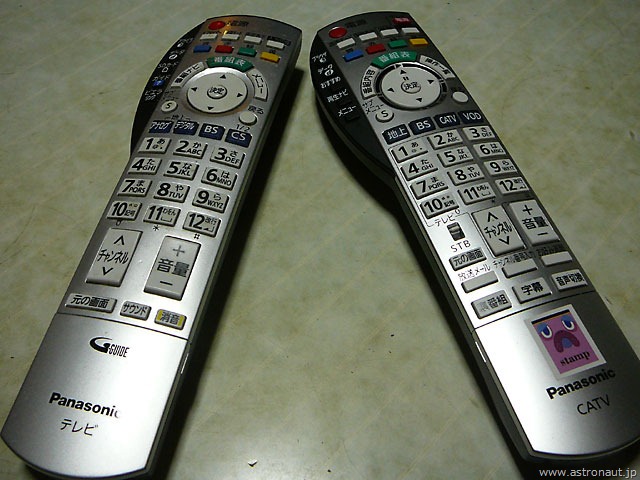
You are a GUI agent. You are given a task and a screenshot of the screen. Output one action in this format:
    pyautogui.click(x=<x>, y=<y>)
    Task: Click on the left side remote
    
    Given the screenshot: What is the action you would take?
    pyautogui.click(x=92, y=362)